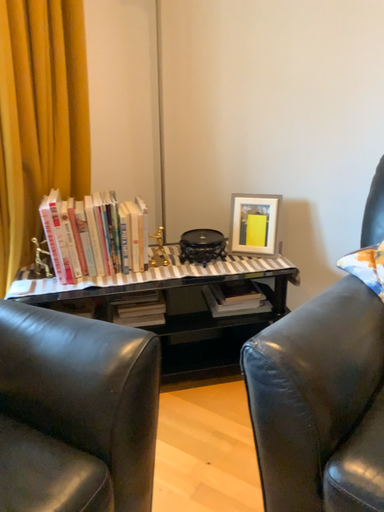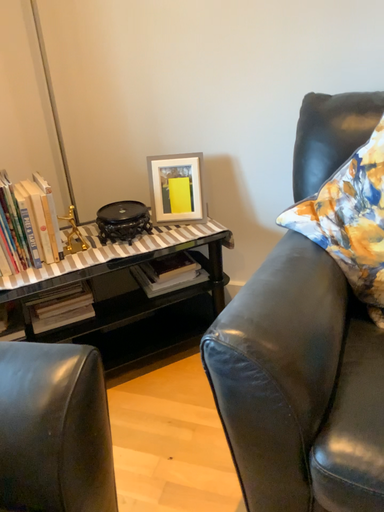
Question: How did the camera likely rotate when shooting the video?

Choices:
 (A) rotated right
 (B) rotated left

Answer: (A)